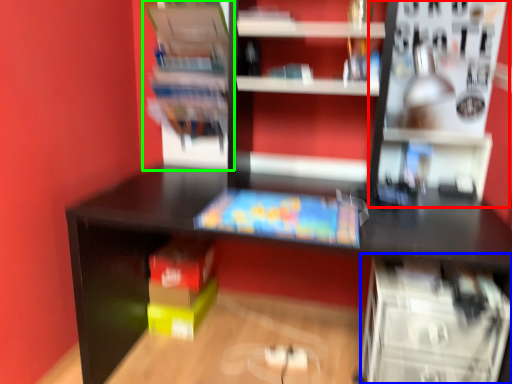
Question: Estimate the real-world distances between objects in this image. Which object is farther from shelf (highlighted by a red box), shelf (highlighted by a blue box) or shelf (highlighted by a green box)?

Choices:
 (A) shelf
 (B) shelf

Answer: (B)